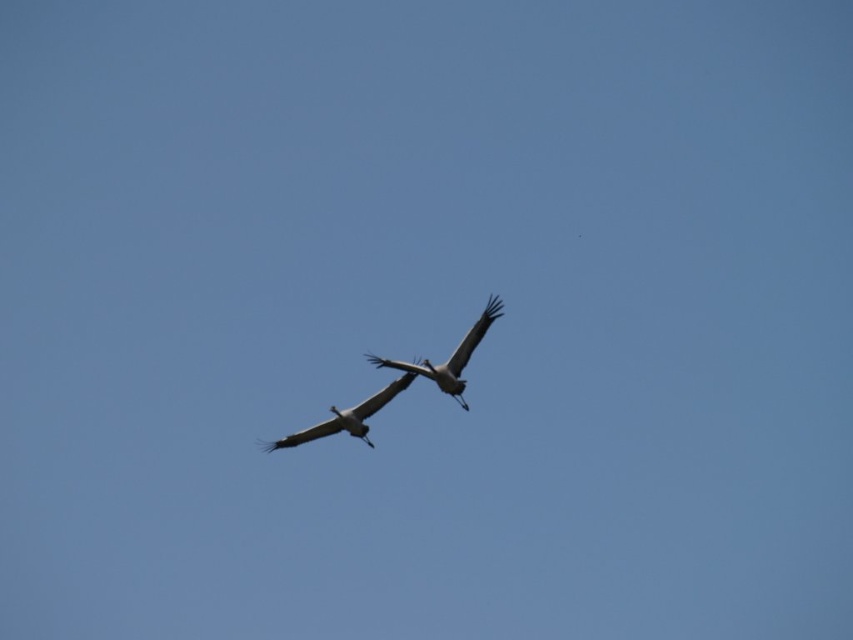
Can you confirm if gray matte bird at center is positioned to the right of white feathered bird at center?

Indeed, gray matte bird at center is positioned on the right side of white feathered bird at center.

Between point (424, 364) and point (364, 403), which one is positioned behind?

The point (364, 403) is behind.

What do you see at coordinates (450, 356) in the screenshot? The height and width of the screenshot is (640, 853). I see `gray matte bird at center` at bounding box center [450, 356].

This screenshot has width=853, height=640. I want to click on gray matte bird at center, so click(x=450, y=356).